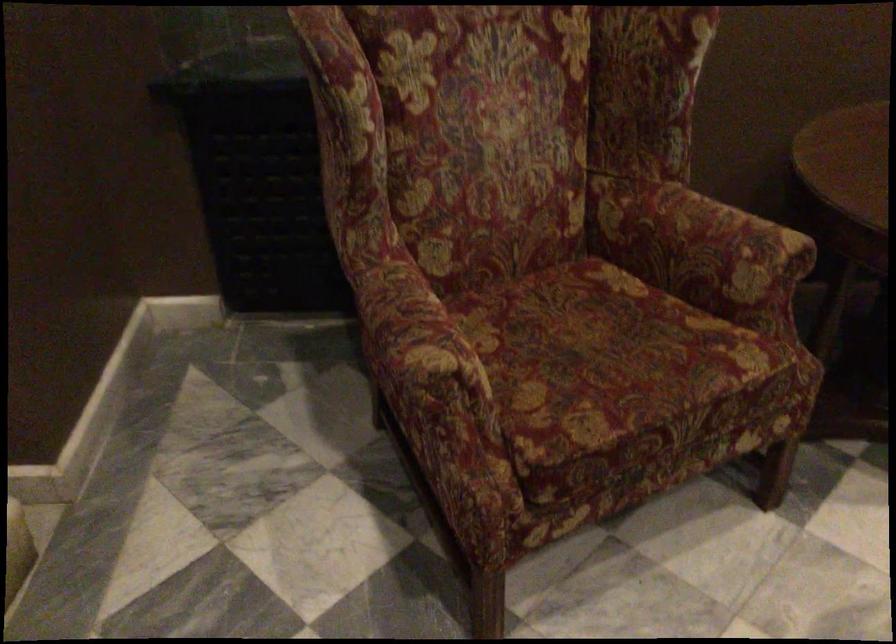
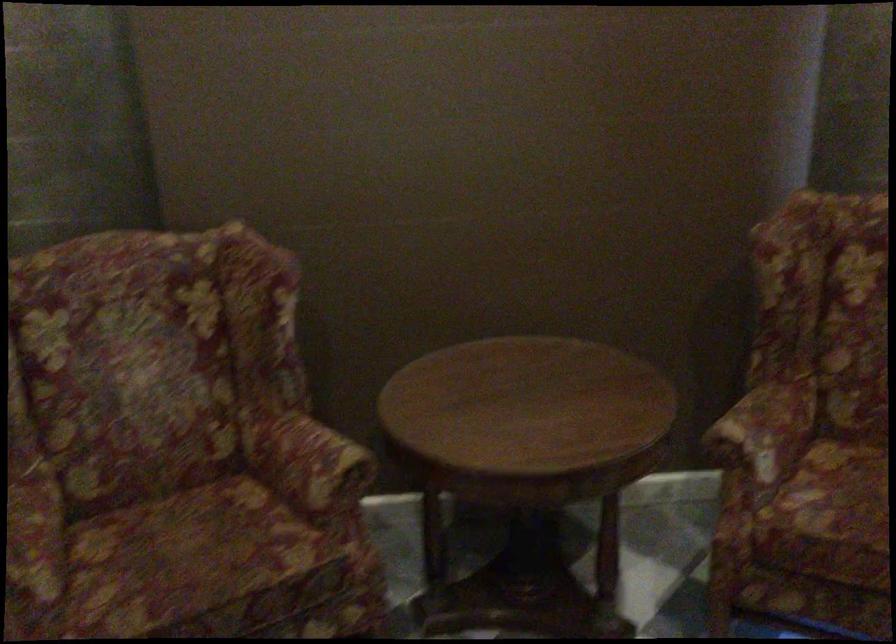
Question: The first image is from the beginning of the video and the second image is from the end. How did the camera likely rotate when shooting the video?

Choices:
 (A) Left
 (B) Right
 (C) Up
 (D) Down

Answer: (C)